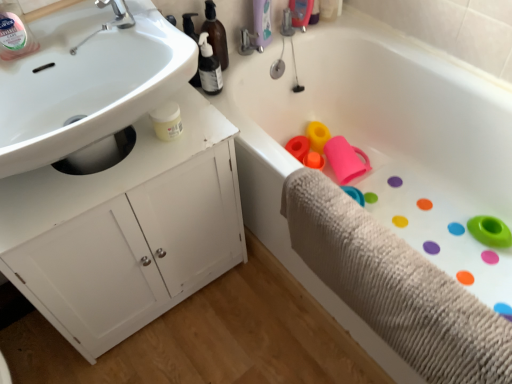
Question: From a real-world perspective, relative to silver metallic faucet at upper left, is white glossy sink at upper left vertically above or below?

Choices:
 (A) below
 (B) above

Answer: (A)

Question: Is point (92, 89) positioned closer to the camera than point (108, 26)?

Choices:
 (A) closer
 (B) farther

Answer: (B)

Question: Which is farther from the clear plastic bottle at upper left?

Choices:
 (A) white rubber bathtub at center
 (B) white matte cabinet at left
 (C) silver metallic faucet at upper left
 (D) beige textured bath towel at lower right
 (E) white glossy sink at upper left

Answer: (A)

Question: Considering the real-world distances, which object is closest to the clear plastic bottle at upper left?

Choices:
 (A) beige textured bath towel at lower right
 (B) silver metallic faucet at upper left
 (C) white rubber bathtub at center
 (D) white glossy sink at upper left
 (E) white matte cabinet at left

Answer: (D)